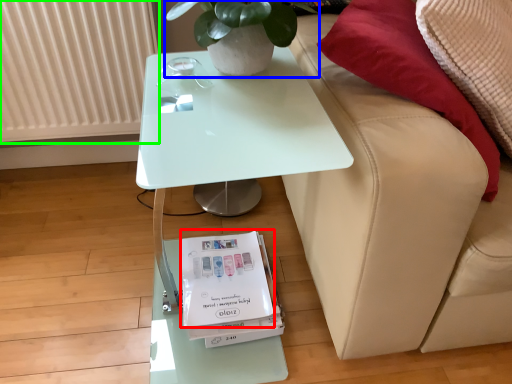
Question: Which object is positioned closest to magazine (highlighted by a red box)? Select from houseplant (highlighted by a blue box) and radiator (highlighted by a green box).

Choices:
 (A) houseplant
 (B) radiator

Answer: (A)